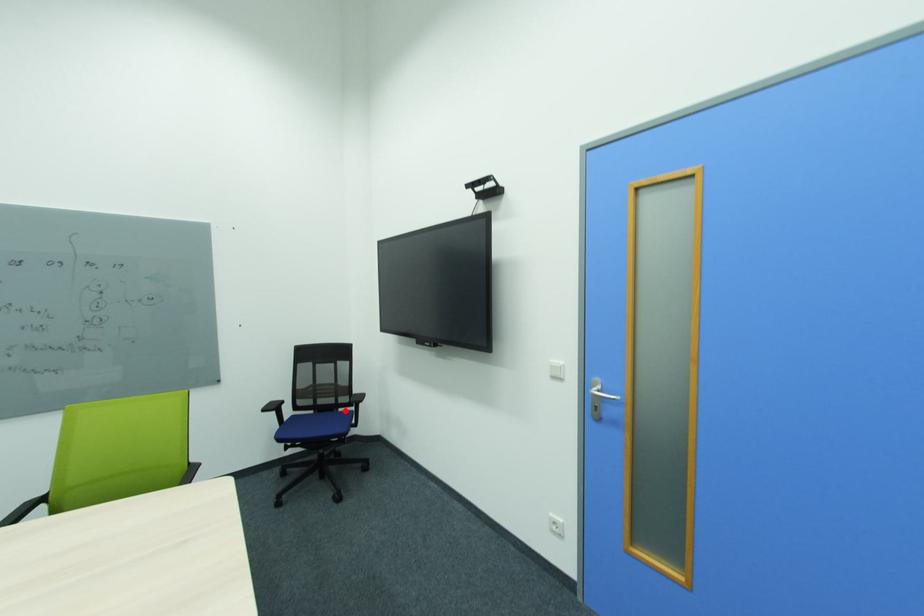
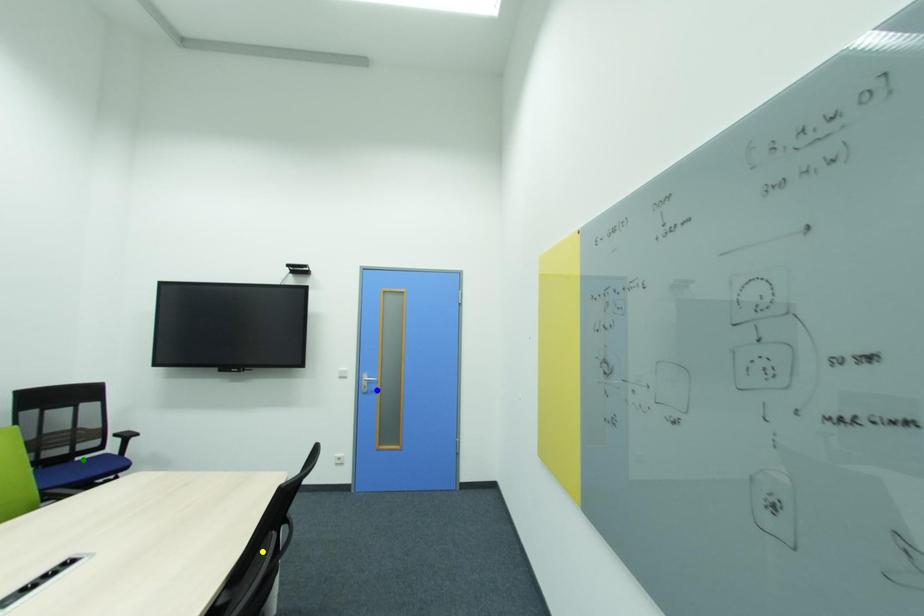
Question: I am providing you with two images of the same scene from different viewpoints. A red point is marked on the first image. You are given multiple points on the second image. Can you choose the point in image 2 that corresponds to the point in image 1?

Choices:
 (A) blue point
 (B) green point
 (C) yellow point

Answer: (B)